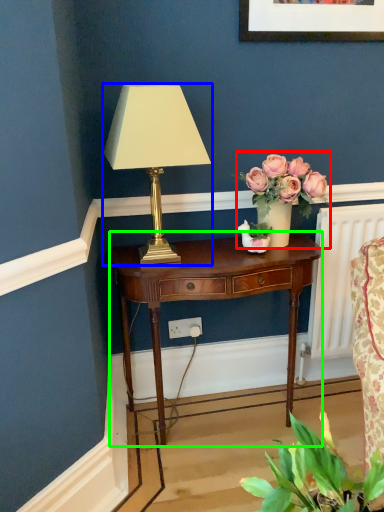
Question: Which object is the closest to the floral arrangement (highlighted by a red box)? Choose among these: lamp (highlighted by a blue box) or nightstand (highlighted by a green box).

Choices:
 (A) lamp
 (B) nightstand

Answer: (B)